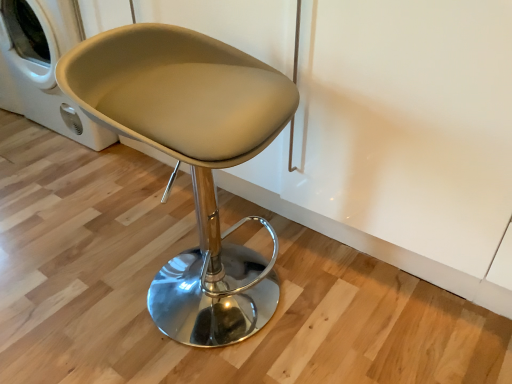
Question: Would you say white glossy washing machine at left is inside or outside beige leather stool at center?

Choices:
 (A) inside
 (B) outside

Answer: (B)

Question: Considering the positions of white glossy washing machine at left and beige leather stool at center in the image, is white glossy washing machine at left wider or thinner than beige leather stool at center?

Choices:
 (A) wide
 (B) thin

Answer: (A)

Question: Considering their positions, is white glossy washing machine at left located in front of or behind beige leather stool at center?

Choices:
 (A) behind
 (B) front

Answer: (A)

Question: Is beige leather stool at center taller or shorter than white glossy washing machine at left?

Choices:
 (A) short
 (B) tall

Answer: (B)

Question: Is beige leather stool at center bigger or smaller than white glossy washing machine at left?

Choices:
 (A) big
 (B) small

Answer: (B)

Question: From the image's perspective, relative to white glossy washing machine at left, is beige leather stool at center above or below?

Choices:
 (A) above
 (B) below

Answer: (B)

Question: From a real-world perspective, is beige leather stool at center above or below white glossy washing machine at left?

Choices:
 (A) below
 (B) above

Answer: (B)